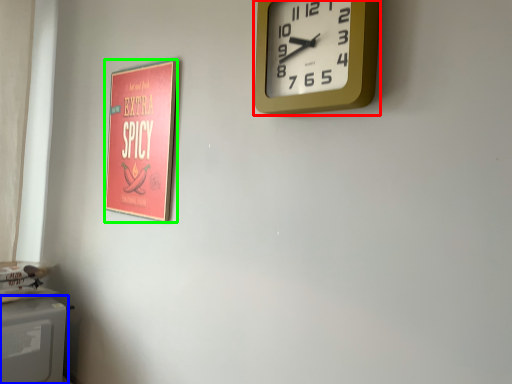
Question: Which is farther away from wall clock (highlighted by a red box)? appliance (highlighted by a blue box) or poster page (highlighted by a green box)?

Choices:
 (A) appliance
 (B) poster page

Answer: (A)